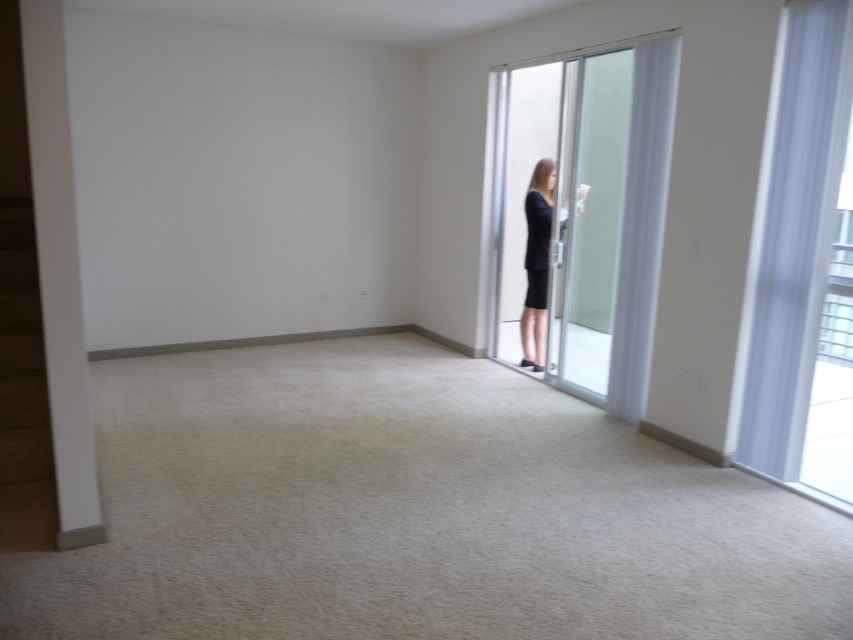
Does clear glass screen door at right appear over black matte dress at center?

Correct, clear glass screen door at right is located above black matte dress at center.

You are a GUI agent. You are given a task and a screenshot of the screen. Output one action in this format:
    pyautogui.click(x=<x>, y=<y>)
    Task: Click on the clear glass screen door at right
    The image size is (853, 640).
    Given the screenshot: What is the action you would take?
    pyautogui.click(x=595, y=220)

Between point (767, 400) and point (537, 305), which one is positioned in front?

Point (767, 400) is in front.

What do you see at coordinates (796, 236) in the screenshot?
I see `transparent fabric curtain at right` at bounding box center [796, 236].

Image resolution: width=853 pixels, height=640 pixels. Identify the location of transparent fabric curtain at right. (796, 236).

Is point (788, 92) less distant than point (605, 243)?

That is True.

Which is more to the left, transparent fabric curtain at right or clear glass screen door at right?

From the viewer's perspective, clear glass screen door at right appears more on the left side.

Between point (793, 92) and point (627, 49), which one is positioned behind?

The point (627, 49) is more distant.

The height and width of the screenshot is (640, 853). Find the location of `transparent fabric curtain at right`. transparent fabric curtain at right is located at coordinates (796, 236).